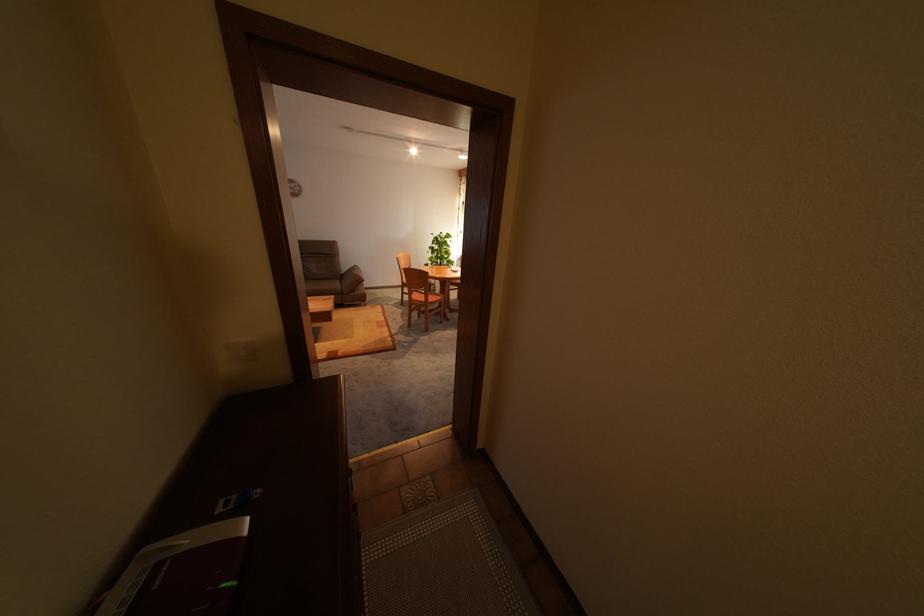
Image resolution: width=924 pixels, height=616 pixels. I want to click on brown sofa sitting surface, so click(322, 286).